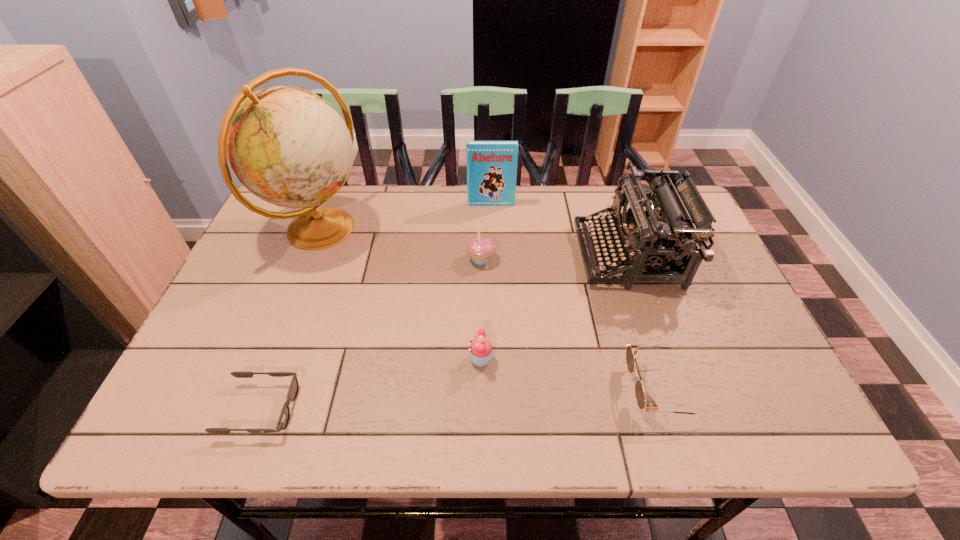
Where is `blank space located 0.270m on the front cover of the book`? The height and width of the screenshot is (540, 960). blank space located 0.270m on the front cover of the book is located at coordinates (492, 268).

The image size is (960, 540). What are the coordinates of `free location located on the typing side of the typewriter` in the screenshot? It's located at (553, 255).

Find the location of a particular element. free space located on the typing side of the typewriter is located at coordinates (487, 255).

Find the location of a particular element. The width and height of the screenshot is (960, 540). free location located 0.310m on the typing side of the typewriter is located at coordinates (465, 255).

Image resolution: width=960 pixels, height=540 pixels. I want to click on vacant position located 0.130m on the front of the taller cupcake, so (x=481, y=307).

Locate an element on the screen. Image resolution: width=960 pixels, height=540 pixels. free space located on the face of the shorter cupcake is located at coordinates (410, 359).

Find the location of a particular element. The image size is (960, 540). vacant space situated 0.300m on the face of the shorter cupcake is located at coordinates (333, 359).

This screenshot has height=540, width=960. Identify the location of free space located 0.360m on the face of the shorter cupcake. (305, 359).

This screenshot has width=960, height=540. I want to click on blank space located on the front lenses of the taller sunglasses, so click(538, 389).

You are a GUI agent. You are given a task and a screenshot of the screen. Output one action in this format:
    pyautogui.click(x=<x>, y=<y>)
    Task: Click on the vacant space located on the front lenses of the taller sunglasses
    
    Given the screenshot: What is the action you would take?
    pyautogui.click(x=605, y=389)